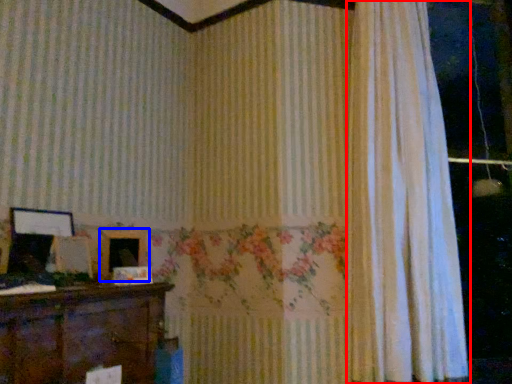
Question: Which object is closer to the camera taking this photo, curtain (highlighted by a red box) or picture frame (highlighted by a blue box)?

Choices:
 (A) curtain
 (B) picture frame

Answer: (B)